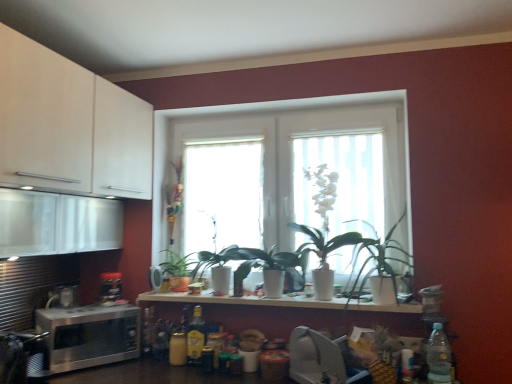
Question: From a real-world perspective, is satin silver microwave at left, acting as the second appliance starting from the right, on satin silver microwave at lower left, which ranks as the second appliance in front-to-back order?

Choices:
 (A) no
 (B) yes

Answer: (B)

Question: Is satin silver microwave at lower left, the first appliance viewed from the left, completely or partially inside satin silver microwave at left, acting as the 1th appliance starting from the back?

Choices:
 (A) yes
 (B) no

Answer: (B)

Question: Does satin silver microwave at left, arranged as the third appliance when viewed from the front, have a lesser height compared to satin silver microwave at lower left, which ranks as the second appliance in front-to-back order?

Choices:
 (A) no
 (B) yes

Answer: (B)

Question: Considering the relative positions of satin silver microwave at left, acting as the second appliance starting from the right, and satin silver microwave at lower left, which appears as the second appliance when viewed from the back, in the image provided, is satin silver microwave at left, acting as the second appliance starting from the right, in front of satin silver microwave at lower left, which appears as the second appliance when viewed from the back,?

Choices:
 (A) no
 (B) yes

Answer: (A)

Question: Can you confirm if satin silver microwave at left, arranged as the third appliance when viewed from the front, is smaller than satin silver microwave at lower left, which ranks as the second appliance in front-to-back order?

Choices:
 (A) yes
 (B) no

Answer: (A)

Question: Considering the positions of metallic silver toaster at lower center, acting as the first appliance starting from the right, and clear plastic bottle at lower right, placed as the third bottle when sorted from back to front, in the image, is metallic silver toaster at lower center, acting as the first appliance starting from the right, taller or shorter than clear plastic bottle at lower right, placed as the third bottle when sorted from back to front,?

Choices:
 (A) tall
 (B) short

Answer: (B)

Question: From a real-world perspective, is metallic silver toaster at lower center, the third appliance in the left-to-right sequence, above or below clear plastic bottle at lower right, placed as the third bottle when sorted from back to front?

Choices:
 (A) below
 (B) above

Answer: (A)

Question: Looking at their shapes, would you say metallic silver toaster at lower center, marked as the 3th appliance in a back-to-front arrangement, is wider or thinner than clear plastic bottle at lower right, the first bottle viewed from the front?

Choices:
 (A) wide
 (B) thin

Answer: (A)

Question: Is point (330, 342) positioned closer to the camera than point (438, 349)?

Choices:
 (A) farther
 (B) closer

Answer: (B)

Question: Considering the positions of satin silver microwave at lower left and translucent glass window at center in the image, is satin silver microwave at lower left bigger or smaller than translucent glass window at center?

Choices:
 (A) big
 (B) small

Answer: (B)

Question: In the image, is satin silver microwave at lower left on the left side or the right side of translucent glass window at center?

Choices:
 (A) left
 (B) right

Answer: (A)

Question: Is point [69, 339] closer or farther from the camera than point [187, 175]?

Choices:
 (A) closer
 (B) farther

Answer: (A)

Question: Considering their positions, is satin silver microwave at lower left located in front of or behind translucent glass window at center?

Choices:
 (A) front
 (B) behind

Answer: (A)

Question: From a real-world perspective, is satin silver microwave at lower left positioned above or below green matte plant at center, the 1th houseplant from the back?

Choices:
 (A) above
 (B) below

Answer: (B)

Question: Which is correct: satin silver microwave at lower left is inside green matte plant at center, the 1th houseplant viewed from the left, or outside of it?

Choices:
 (A) outside
 (B) inside

Answer: (A)